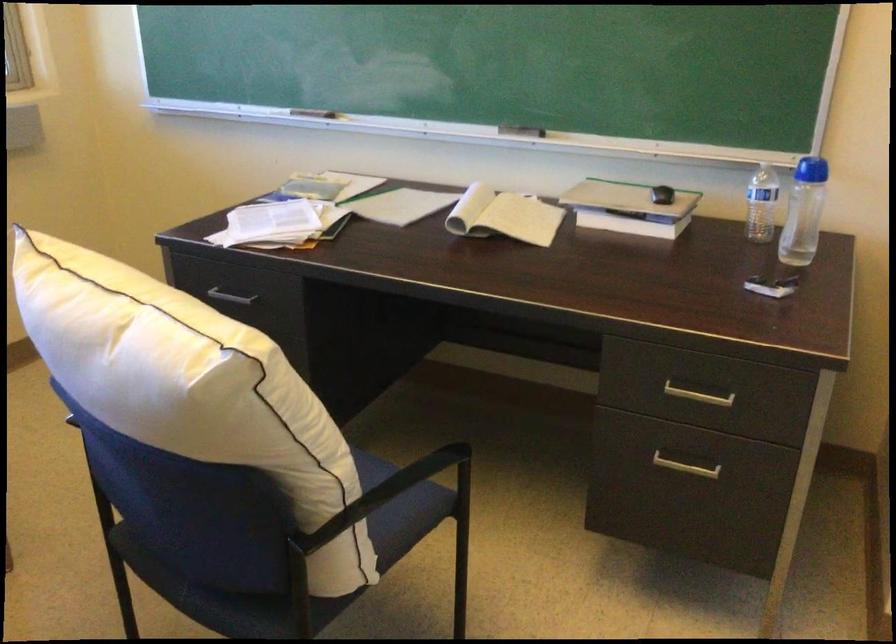
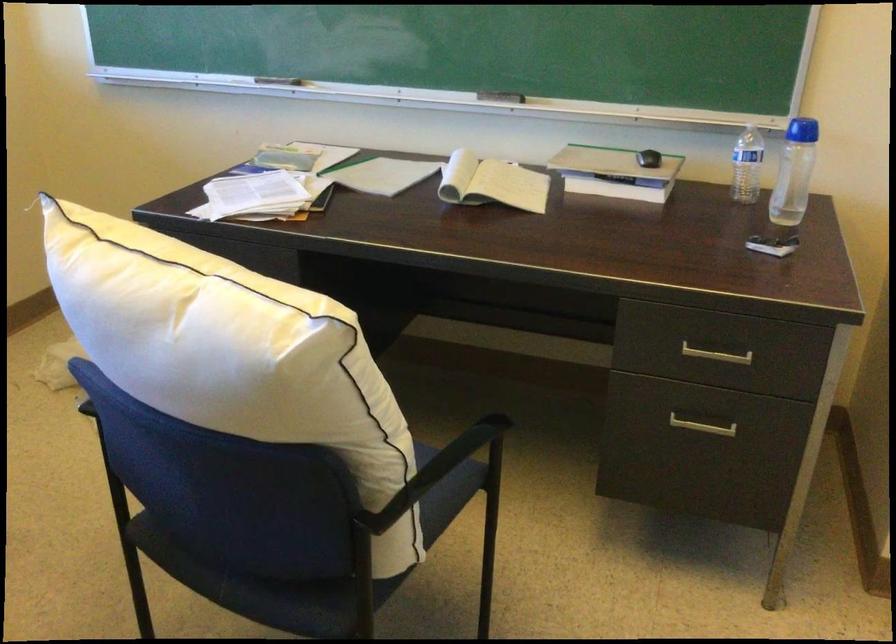
In the second image, find the point that corresponds to point 518,129 in the first image.

(501, 96)